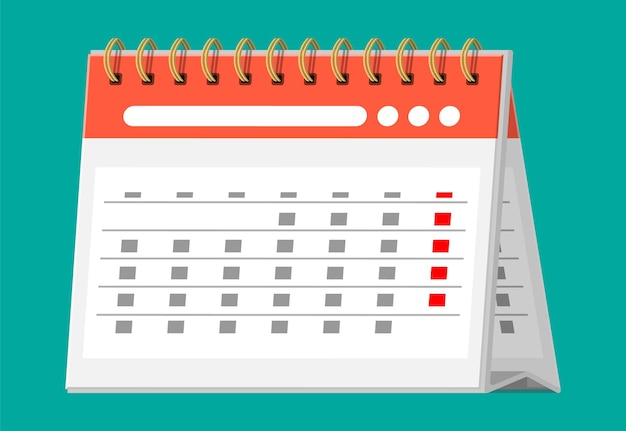
You are a GUI agent. You are given a task and a screenshot of the screen. Output one action in this format:
    pyautogui.click(x=<x>, y=<y>)
    Task: Click on the boxes on the bottom row
    
    Given the screenshot: What is the action you would take?
    pyautogui.click(x=121, y=327), pyautogui.click(x=175, y=328), pyautogui.click(x=228, y=326), pyautogui.click(x=280, y=327), pyautogui.click(x=334, y=326), pyautogui.click(x=382, y=329)